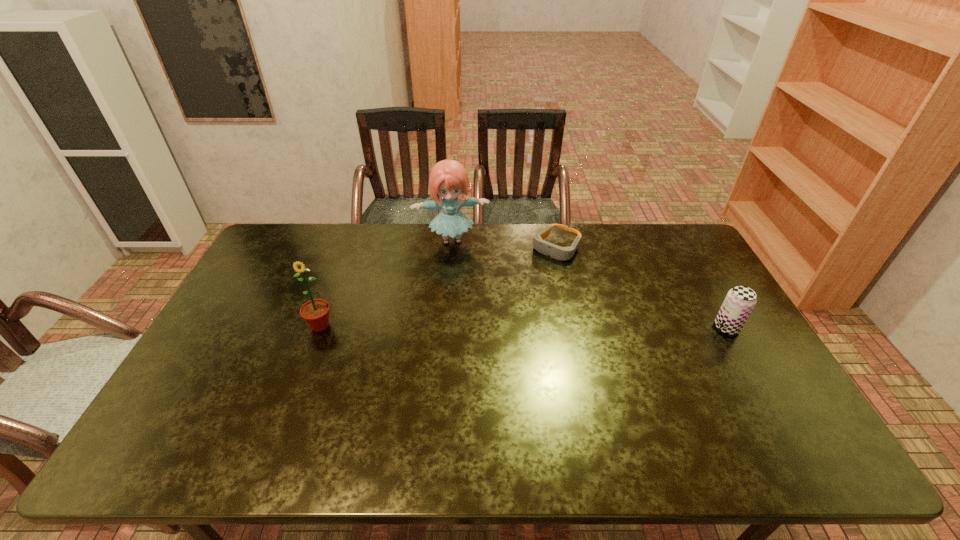
Identify the location of vacant area located 0.200m on the front and back of the second object from right to left. (516, 294).

Find the location of a particular element. blank space located 0.080m on the front and back of the second object from right to left is located at coordinates (534, 274).

Where is `vacant region located 0.110m on the front and back of the second object from right to left`? The height and width of the screenshot is (540, 960). vacant region located 0.110m on the front and back of the second object from right to left is located at coordinates (530, 278).

Locate an element on the screen. This screenshot has height=540, width=960. vacant space situated 0.140m on the front-facing side of the doll is located at coordinates (461, 279).

This screenshot has height=540, width=960. Find the location of `blank space located on the front-facing side of the doll`. blank space located on the front-facing side of the doll is located at coordinates (464, 301).

Locate an element on the screen. The width and height of the screenshot is (960, 540). vacant space positioned on the front-facing side of the doll is located at coordinates (465, 303).

Locate an element on the screen. goggles positioned at the far edge is located at coordinates tap(557, 252).

At what (x,y) coordinates should I click in order to perform the action: click on doll that is at the far edge. Please return your answer as a coordinate pair (x, y). The image size is (960, 540). Looking at the image, I should click on (448, 178).

I want to click on object at the right edge, so tap(740, 300).

Where is `vacant space at the far edge`? The height and width of the screenshot is (540, 960). vacant space at the far edge is located at coordinates (358, 234).